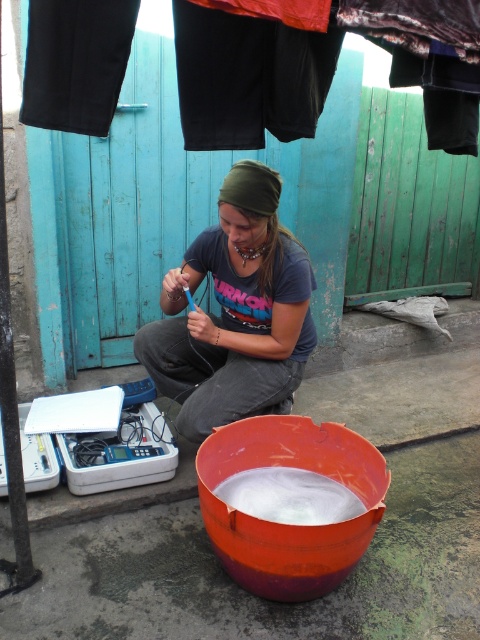
You are standing at the point with coordinates point (255,596). Which object are you standing on?

The point (255,596) is on orange plastic bucket at lower center, so you are standing on the orange plastic bucket at lower center.

Based on the scene, which object is positioned higher relative to the other? The matte gray shirt at center or the white frothy substance at lower center?

The matte gray shirt at center is above the white frothy substance at lower center, so it is positioned higher.